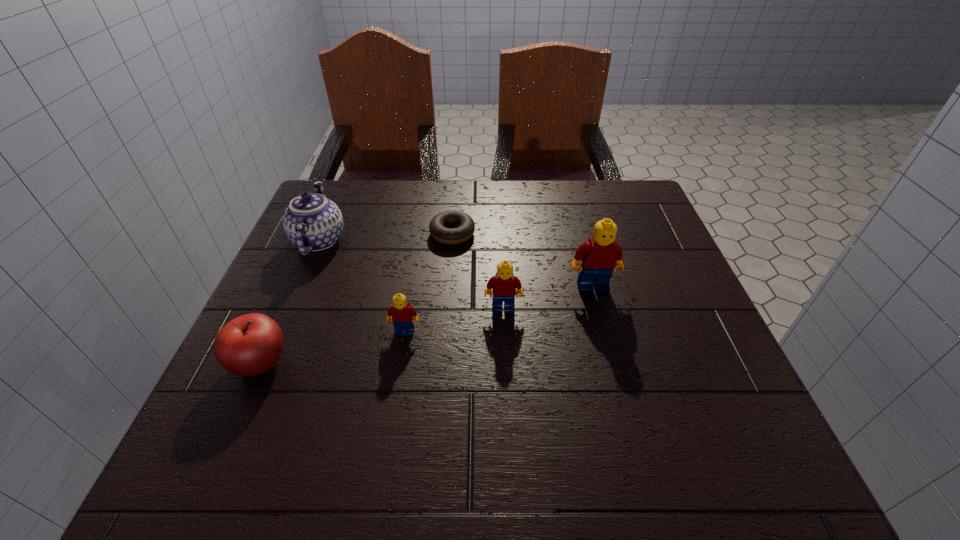
Where is `empty location between the second tallest Lego and the leftmost Lego`? empty location between the second tallest Lego and the leftmost Lego is located at coordinates (454, 320).

Identify the location of empty space that is in between the chinaware and the farthest Lego. The height and width of the screenshot is (540, 960). (456, 264).

This screenshot has height=540, width=960. I want to click on free space that is in between the chinaware and the nearest object, so click(290, 302).

Identify the location of vacant area between the rightmost Lego and the chinaware. The image size is (960, 540). (456, 264).

Where is `empty space between the farthest Lego and the second object from right to left`? The height and width of the screenshot is (540, 960). empty space between the farthest Lego and the second object from right to left is located at coordinates (548, 298).

At what (x,y) coordinates should I click in order to perform the action: click on unoccupied position between the second Lego from right to left and the chinaware. Please return your answer as a coordinate pair (x, y). The image size is (960, 540). Looking at the image, I should click on (411, 274).

Identify the location of vacant point located between the second nearest object and the apple. The image size is (960, 540). (333, 347).

At what (x,y) coordinates should I click in order to perform the action: click on object that ranks as the fourth closest to the apple. Please return your answer as a coordinate pair (x, y). This screenshot has height=540, width=960. Looking at the image, I should click on (504, 285).

Locate which object ranks fourth in proximity to the chinaware. Please provide its 2D coordinates. Your answer should be formatted as a tuple, i.e. [(x, y)], where the tuple contains the x and y coordinates of a point satisfying the conditions above.

[(504, 285)]

Point out which Lego is positioned as the second nearest to the third nearest object. Please provide its 2D coordinates. Your answer should be formatted as a tuple, i.e. [(x, y)], where the tuple contains the x and y coordinates of a point satisfying the conditions above.

[(400, 314)]